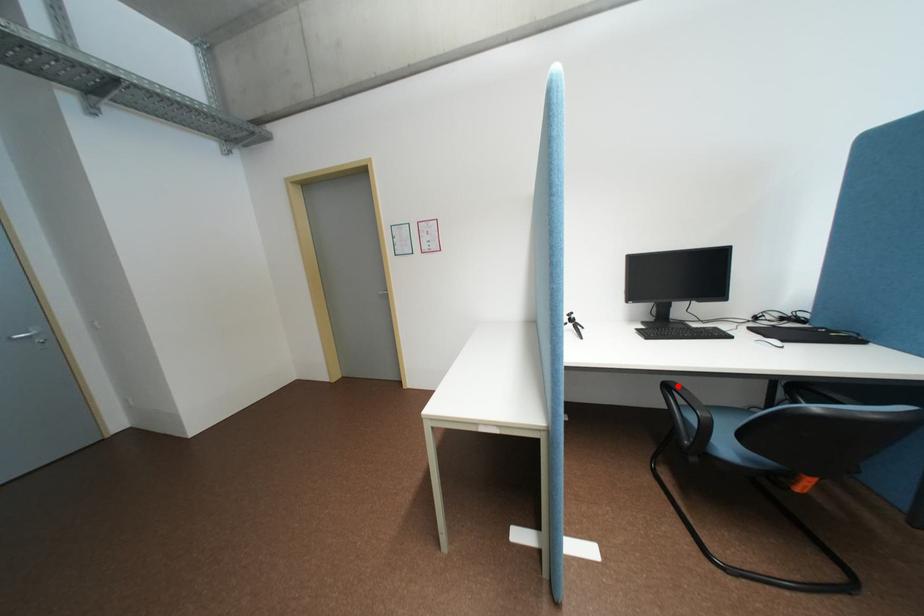
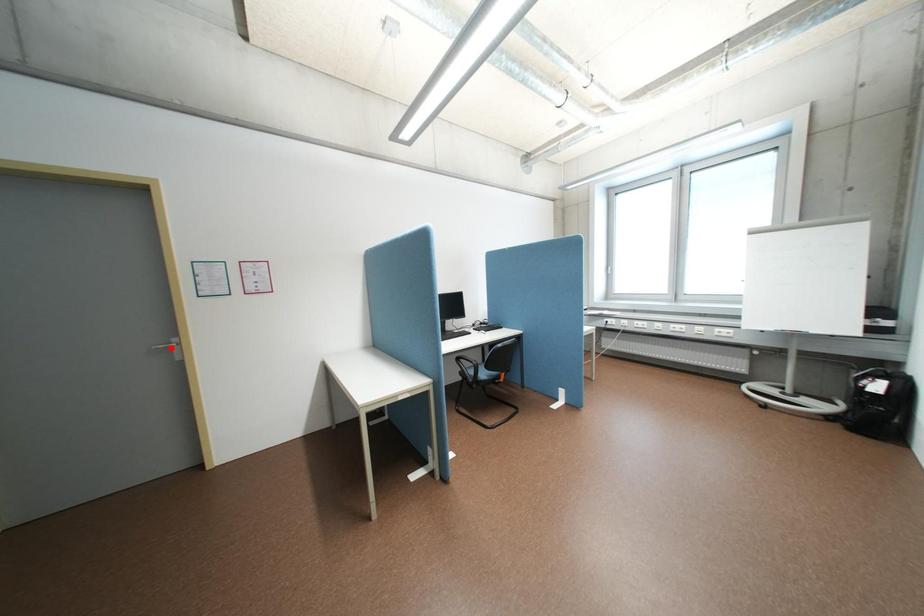
I am providing you with two images of the same scene from different viewpoints. A red point is marked on the first image and another point is marked on the second image. Does the point marked in image1 correspond to the same location as the one in image2?

No